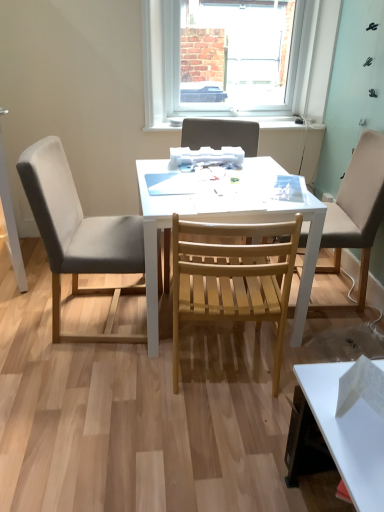
At what (x,y) coordinates should I click in order to perform the action: click on vacant area on top of white matte desk at center (from a real-world perspective). Please return your answer as a coordinate pair (x, y). Image resolution: width=384 pixels, height=512 pixels. Looking at the image, I should click on (196, 178).